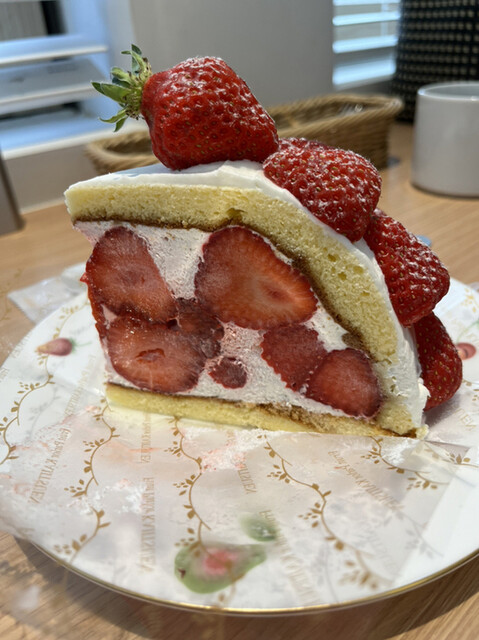
You are a GUI agent. You are given a task and a screenshot of the screen. Output one action in this format:
    pyautogui.click(x=<x>, y=<y>)
    Task: Click on the windows
    The width and height of the screenshot is (479, 640).
    Given the screenshot: What is the action you would take?
    pyautogui.click(x=345, y=32), pyautogui.click(x=17, y=17)